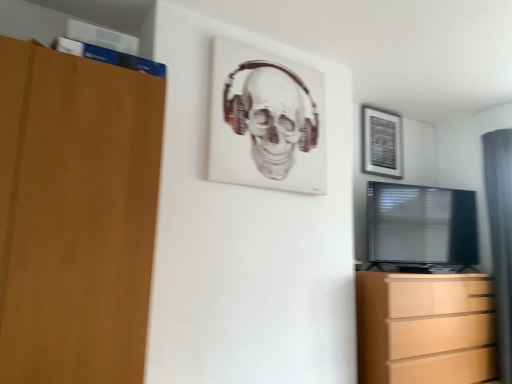
What is the approximate width of black glossy tv at right?

The width of black glossy tv at right is 11.43 inches.

What do you see at coordinates (266, 121) in the screenshot? I see `white matte picture frame at upper center, which ranks as the 2th picture frame in right-to-left order` at bounding box center [266, 121].

This screenshot has width=512, height=384. What are the coordinates of `matte black picture frame at upper right, the first picture frame viewed from the back` in the screenshot? It's located at (382, 142).

Describe the element at coordinates (425, 328) in the screenshot. I see `light brown wooden chest of drawers at lower right` at that location.

Describe the element at coordinates (500, 237) in the screenshot. I see `gray fabric curtain at right` at that location.

Identify the location of black glossy tv at right. click(421, 225).

Locate an element on the screen. The width and height of the screenshot is (512, 384). chest of drawers below the white matte picture frame at upper center, the first picture frame positioned from the front (from a real-world perspective) is located at coordinates (425, 328).

From the image's perspective, between light brown wooden chest of drawers at lower right and white matte picture frame at upper center, which ranks as the 2th picture frame in right-to-left order, which one is located above?

white matte picture frame at upper center, which ranks as the 2th picture frame in right-to-left order.

From a real-world perspective, who is located lower, light brown wooden chest of drawers at lower right or white matte picture frame at upper center, the first picture frame positioned from the left?

light brown wooden chest of drawers at lower right, from a real-world perspective.

In terms of size, does white matte picture frame at upper center, the first picture frame positioned from the left, appear bigger or smaller than black glossy tv at right?

Clearly, white matte picture frame at upper center, the first picture frame positioned from the left, is smaller in size than black glossy tv at right.

Can you confirm if white matte picture frame at upper center, which ranks as the 2th picture frame in right-to-left order, is wider than black glossy tv at right?

No.

Where is `television directly beneath the white matte picture frame at upper center, the first picture frame positioned from the left (from a real-world perspective)`? television directly beneath the white matte picture frame at upper center, the first picture frame positioned from the left (from a real-world perspective) is located at coordinates (421, 225).

From the image's perspective, relative to black glossy tv at right, is white matte picture frame at upper center, the first picture frame positioned from the front, above or below?

Based on their image positions, white matte picture frame at upper center, the first picture frame positioned from the front, is located above black glossy tv at right.

How far apart are white matte picture frame at upper center, which ranks as the 2th picture frame in right-to-left order, and gray fabric curtain at right?

white matte picture frame at upper center, which ranks as the 2th picture frame in right-to-left order, and gray fabric curtain at right are 1.92 meters apart.

Is point (273, 112) farther from camera compared to point (507, 284)?

No, (273, 112) is in front of (507, 284).

How different are the orientations of white matte picture frame at upper center, the first picture frame positioned from the front, and gray fabric curtain at right in degrees?

white matte picture frame at upper center, the first picture frame positioned from the front, and gray fabric curtain at right are facing 87.4 degrees away from each other.

Which of these two, white matte picture frame at upper center, which is the 2th picture frame from back to front, or gray fabric curtain at right, stands taller?

Standing taller between the two is gray fabric curtain at right.

Can you confirm if white matte picture frame at upper center, which ranks as the 2th picture frame in right-to-left order, is thinner than light brown wooden chest of drawers at lower right?

Correct, the width of white matte picture frame at upper center, which ranks as the 2th picture frame in right-to-left order, is less than that of light brown wooden chest of drawers at lower right.

Can you confirm if white matte picture frame at upper center, which ranks as the 2th picture frame in right-to-left order, is smaller than light brown wooden chest of drawers at lower right?

Correct, white matte picture frame at upper center, which ranks as the 2th picture frame in right-to-left order, occupies less space than light brown wooden chest of drawers at lower right.

From the image's perspective, is white matte picture frame at upper center, which is the 2th picture frame from back to front, positioned above or below light brown wooden chest of drawers at lower right?

white matte picture frame at upper center, which is the 2th picture frame from back to front, is above light brown wooden chest of drawers at lower right.

Considering the positions of point (260, 137) and point (368, 373), is point (260, 137) closer or farther from the camera than point (368, 373)?

Point (260, 137) appears to be closer to the viewer than point (368, 373).

Which point is more forward, [471,350] or [383,110]?

Positioned in front is point [471,350].

From a real-world perspective, count 2nd picture frames upward from the light brown wooden chest of drawers at lower right and point to it. Please provide its 2D coordinates.

[(382, 142)]

Which object is positioned more to the left, light brown wooden chest of drawers at lower right or matte black picture frame at upper right, arranged as the second picture frame when viewed from the left?

Positioned to the left is matte black picture frame at upper right, arranged as the second picture frame when viewed from the left.

Does light brown wooden chest of drawers at lower right have a smaller size compared to matte black picture frame at upper right, arranged as the second picture frame when viewed from the left?

Incorrect, light brown wooden chest of drawers at lower right is not smaller in size than matte black picture frame at upper right, arranged as the second picture frame when viewed from the left.

Locate an element on the screen. Image resolution: width=512 pixels, height=384 pixels. the 1st picture frame counting from the left side of the black glossy tv at right is located at coordinates (382, 142).

Does matte black picture frame at upper right, arranged as the second picture frame when viewed from the left, contain black glossy tv at right?

No.

In terms of height, does matte black picture frame at upper right, arranged as the second picture frame when viewed from the left, look taller or shorter compared to black glossy tv at right?

matte black picture frame at upper right, arranged as the second picture frame when viewed from the left, is shorter than black glossy tv at right.

From the image's perspective, which is below, matte black picture frame at upper right, arranged as the second picture frame when viewed from the left, or white matte picture frame at upper center, which ranks as the 2th picture frame in right-to-left order?

matte black picture frame at upper right, arranged as the second picture frame when viewed from the left, appears lower in the image.

Can you confirm if matte black picture frame at upper right, arranged as the second picture frame when viewed from the front, is positioned to the left of white matte picture frame at upper center, the first picture frame positioned from the front?

No, matte black picture frame at upper right, arranged as the second picture frame when viewed from the front, is not to the left of white matte picture frame at upper center, the first picture frame positioned from the front.

Who is bigger, matte black picture frame at upper right, arranged as the second picture frame when viewed from the left, or white matte picture frame at upper center, which ranks as the 2th picture frame in right-to-left order?

Bigger between the two is white matte picture frame at upper center, which ranks as the 2th picture frame in right-to-left order.

The image size is (512, 384). What are the coordinates of `picture frame behind the white matte picture frame at upper center, the first picture frame positioned from the left` in the screenshot? It's located at (382, 142).

Starting from the light brown wooden chest of drawers at lower right, which picture frame is the 2nd one to the left? Please provide its 2D coordinates.

[(266, 121)]

This screenshot has width=512, height=384. In order to click on television located below the white matte picture frame at upper center, the first picture frame positioned from the front (from the image's perspective) in this screenshot , I will do `click(421, 225)`.

When comparing their distances from gray fabric curtain at right, does matte black picture frame at upper right, arranged as the second picture frame when viewed from the left, or light brown wooden chest of drawers at lower right seem closer?

The object closer to gray fabric curtain at right is light brown wooden chest of drawers at lower right.

Estimate the real-world distances between objects in this image. Which object is further from matte black picture frame at upper right, the first picture frame viewed from the back, white matte picture frame at upper center, which ranks as the 2th picture frame in right-to-left order, or black glossy tv at right?

Among the two, white matte picture frame at upper center, which ranks as the 2th picture frame in right-to-left order, is located further to matte black picture frame at upper right, the first picture frame viewed from the back.

Estimate the real-world distances between objects in this image. Which object is closer to light brown wooden chest of drawers at lower right, black glossy tv at right or white matte picture frame at upper center, the first picture frame positioned from the left?

The object closer to light brown wooden chest of drawers at lower right is black glossy tv at right.

Estimate the real-world distances between objects in this image. Which object is further from matte black picture frame at upper right, the first picture frame viewed from the back, light brown wooden chest of drawers at lower right or gray fabric curtain at right?

light brown wooden chest of drawers at lower right is further to matte black picture frame at upper right, the first picture frame viewed from the back.

Looking at the image, which one is located closer to light brown wooden chest of drawers at lower right, white matte picture frame at upper center, the first picture frame positioned from the left, or gray fabric curtain at right?

gray fabric curtain at right.

When comparing their distances from light brown wooden chest of drawers at lower right, does white matte picture frame at upper center, the first picture frame positioned from the left, or matte black picture frame at upper right, the first picture frame viewed from the back, seem closer?

white matte picture frame at upper center, the first picture frame positioned from the left, lies closer to light brown wooden chest of drawers at lower right than the other object.

Estimate the real-world distances between objects in this image. Which object is closer to black glossy tv at right, white matte picture frame at upper center, which ranks as the 2th picture frame in right-to-left order, or gray fabric curtain at right?

Based on the image, gray fabric curtain at right appears to be nearer to black glossy tv at right.

From the image, which object appears to be nearer to white matte picture frame at upper center, which is the 2th picture frame from back to front, gray fabric curtain at right or light brown wooden chest of drawers at lower right?

Among the two, light brown wooden chest of drawers at lower right is located nearer to white matte picture frame at upper center, which is the 2th picture frame from back to front.

Locate an element on the screen. picture frame between white matte picture frame at upper center, the first picture frame positioned from the left, and gray fabric curtain at right is located at coordinates (382, 142).

Image resolution: width=512 pixels, height=384 pixels. I want to click on picture frame situated between white matte picture frame at upper center, the first picture frame positioned from the left, and black glossy tv at right from left to right, so click(x=382, y=142).

The image size is (512, 384). In order to click on television between matte black picture frame at upper right, arranged as the second picture frame when viewed from the left, and gray fabric curtain at right from top to bottom in this screenshot , I will do `click(421, 225)`.

Identify the location of television between white matte picture frame at upper center, which ranks as the 2th picture frame in right-to-left order, and gray fabric curtain at right from left to right. Image resolution: width=512 pixels, height=384 pixels. (421, 225).